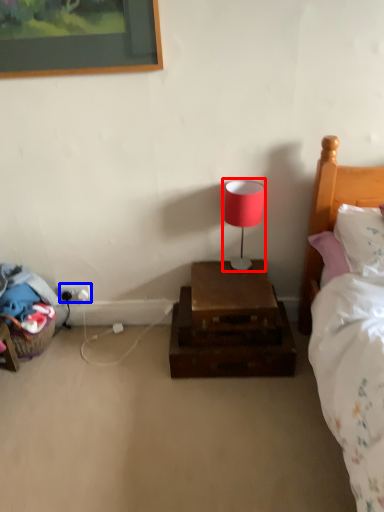
Question: Which object appears farthest to the camera in this image, table lamp (highlighted by a red box) or electric outlet (highlighted by a blue box)?

Choices:
 (A) table lamp
 (B) electric outlet

Answer: (B)